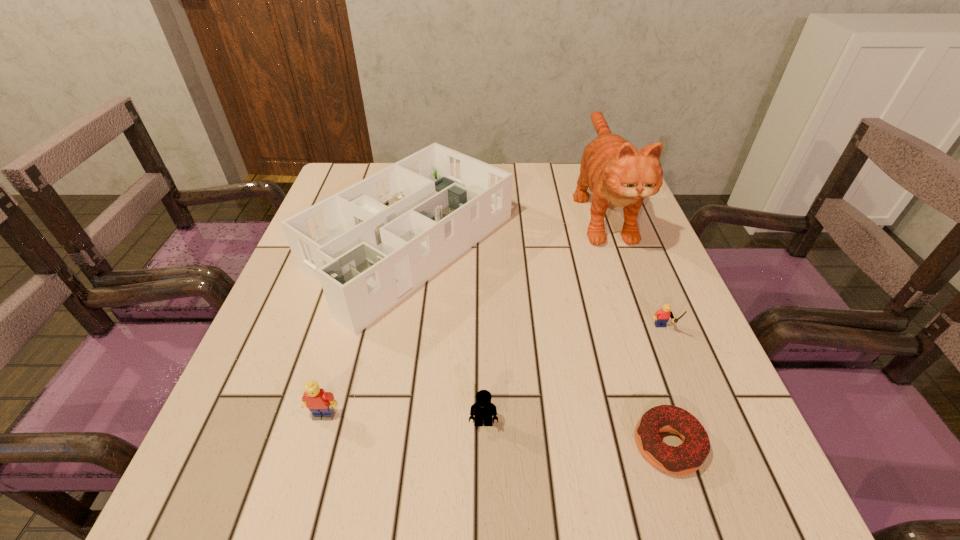
You are a GUI agent. You are given a task and a screenshot of the screen. Output one action in this format:
    pyautogui.click(x=<x>, y=<y>)
    Task: Click on the Lego that is the second closest one to the second Lego from right to left
    The width and height of the screenshot is (960, 540).
    Given the screenshot: What is the action you would take?
    pyautogui.click(x=662, y=316)